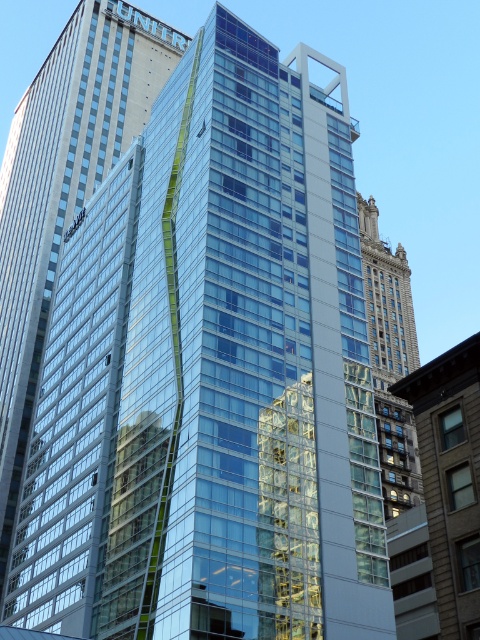
Question: Is transparent glass building at center behind brown stone tower at center?

Choices:
 (A) yes
 (B) no

Answer: (B)

Question: Is transparent glass building at center further to camera compared to brown stone tower at center?

Choices:
 (A) no
 (B) yes

Answer: (A)

Question: Which point is farther to the camera?

Choices:
 (A) brown stone tower at center
 (B) transparent glass building at center

Answer: (A)

Question: Does transparent glass building at center lie in front of brown stone tower at center?

Choices:
 (A) yes
 (B) no

Answer: (A)

Question: Which point is farther to the camera?

Choices:
 (A) brown stone tower at center
 (B) transparent glass building at center

Answer: (A)